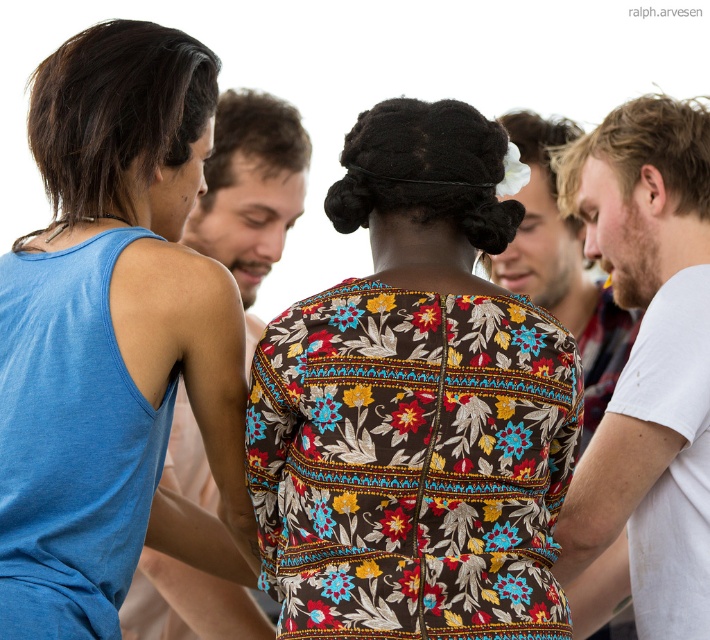
Question: Where is white cotton t-shirt at right located in relation to matte blue tank top at left in the image?

Choices:
 (A) below
 (B) above

Answer: (A)

Question: Estimate the real-world distances between objects in this image. Which object is closer to the white cotton shirt at center?

Choices:
 (A) floral fabric dress at center
 (B) blue cotton tank top at left
 (C) white cotton t-shirt at right
 (D) matte blue tank top at left

Answer: (D)

Question: Which point appears closest to the camera in this image?

Choices:
 (A) (594, 624)
 (B) (245, 198)

Answer: (A)

Question: Does blue cotton tank top at left have a lesser width compared to white cotton shirt at center?

Choices:
 (A) no
 (B) yes

Answer: (A)

Question: Does white cotton t-shirt at right appear over matte blue tank top at left?

Choices:
 (A) no
 (B) yes

Answer: (A)

Question: Which object is positioned closest to the matte blue tank top at left?

Choices:
 (A) floral fabric dress at center
 (B) blue cotton tank top at left

Answer: (B)